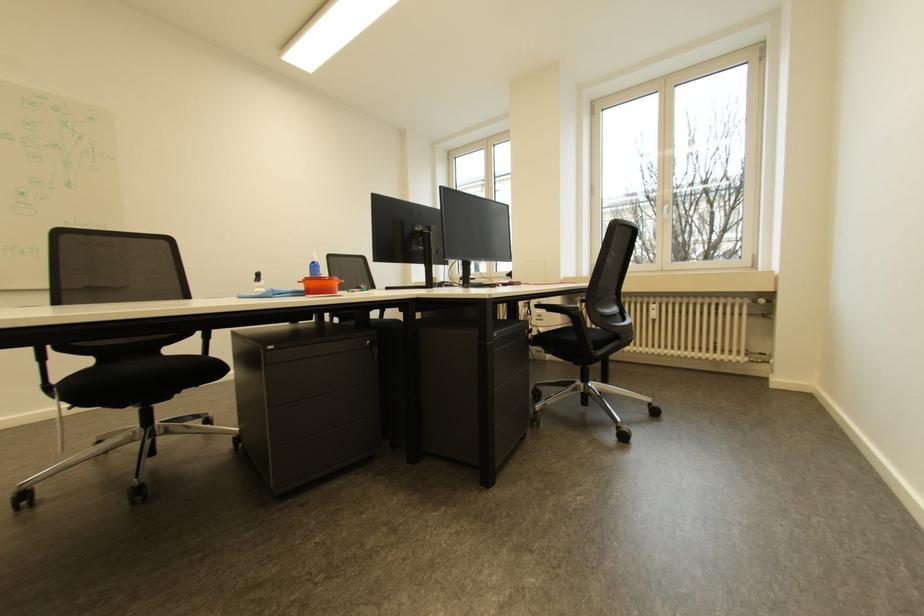
Locate an element on the screen. white window handle is located at coordinates (667, 212).